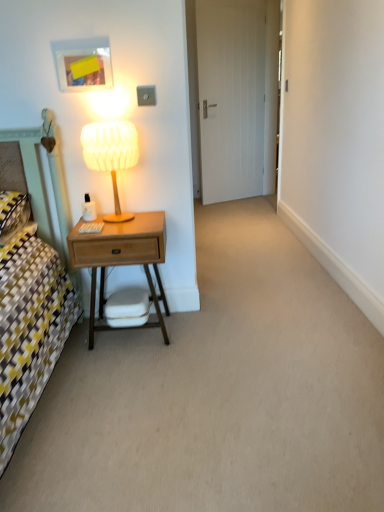
Question: Does white matte swivel chair at center appear on the left side of wooden nightstand at left?

Choices:
 (A) no
 (B) yes

Answer: (A)

Question: From the image's perspective, is white matte swivel chair at center below wooden nightstand at left?

Choices:
 (A) no
 (B) yes

Answer: (B)

Question: Does white matte swivel chair at center have a smaller size compared to wooden nightstand at left?

Choices:
 (A) no
 (B) yes

Answer: (B)

Question: Does white matte swivel chair at center have a greater height compared to wooden nightstand at left?

Choices:
 (A) no
 (B) yes

Answer: (A)

Question: Is white matte swivel chair at center closer to camera compared to wooden nightstand at left?

Choices:
 (A) no
 (B) yes

Answer: (A)

Question: Considering the positions of wooden nightstand at left and white matte swivel chair at center in the image, is wooden nightstand at left taller or shorter than white matte swivel chair at center?

Choices:
 (A) short
 (B) tall

Answer: (B)

Question: Considering the positions of point (79, 234) and point (119, 292), is point (79, 234) closer or farther from the camera than point (119, 292)?

Choices:
 (A) farther
 (B) closer

Answer: (B)

Question: Is wooden nightstand at left inside or outside of white matte swivel chair at center?

Choices:
 (A) outside
 (B) inside

Answer: (A)

Question: Would you say wooden nightstand at left is to the left or to the right of white matte swivel chair at center in the picture?

Choices:
 (A) left
 (B) right

Answer: (A)

Question: Is white matte door at center wider or thinner than white matte swivel chair at center?

Choices:
 (A) wide
 (B) thin

Answer: (B)

Question: In the image, is white matte door at center positioned in front of or behind white matte swivel chair at center?

Choices:
 (A) front
 (B) behind

Answer: (B)

Question: Is white matte door at center bigger or smaller than white matte swivel chair at center?

Choices:
 (A) big
 (B) small

Answer: (A)

Question: Would you say white matte door at center is to the left or to the right of white matte swivel chair at center in the picture?

Choices:
 (A) left
 (B) right

Answer: (B)

Question: Relative to wooden table lamp at left, is white matte swivel chair at center in front or behind?

Choices:
 (A) front
 (B) behind

Answer: (B)

Question: Does point (109, 312) appear closer or farther from the camera than point (96, 140)?

Choices:
 (A) farther
 (B) closer

Answer: (A)